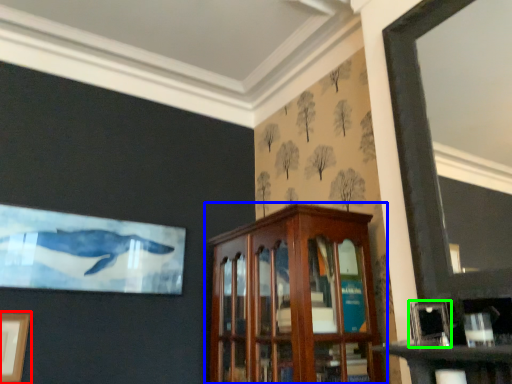
Question: Considering the real-world distances, which object is closest to picture frame (highlighted by a red box)? cabinetry (highlighted by a blue box) or picture frame (highlighted by a green box).

Choices:
 (A) cabinetry
 (B) picture frame

Answer: (A)